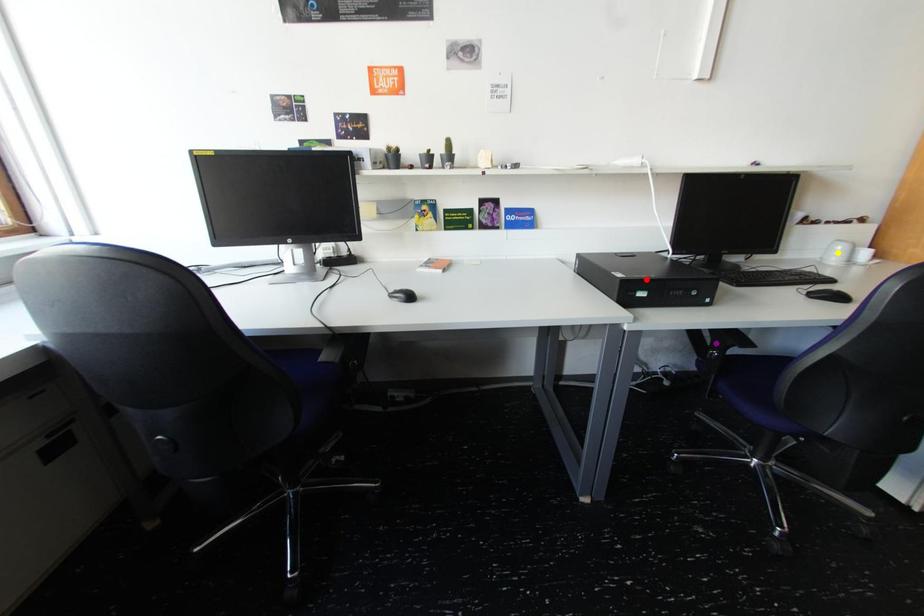
Order these from nearest to farthest:
1. purple point
2. red point
3. yellow point

red point → purple point → yellow point